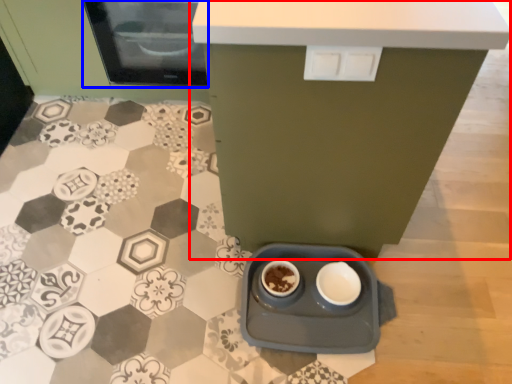
Question: Which of the following is the closest to the observer, table (highlighted by a red box) or home appliance (highlighted by a blue box)?

Choices:
 (A) table
 (B) home appliance

Answer: (A)